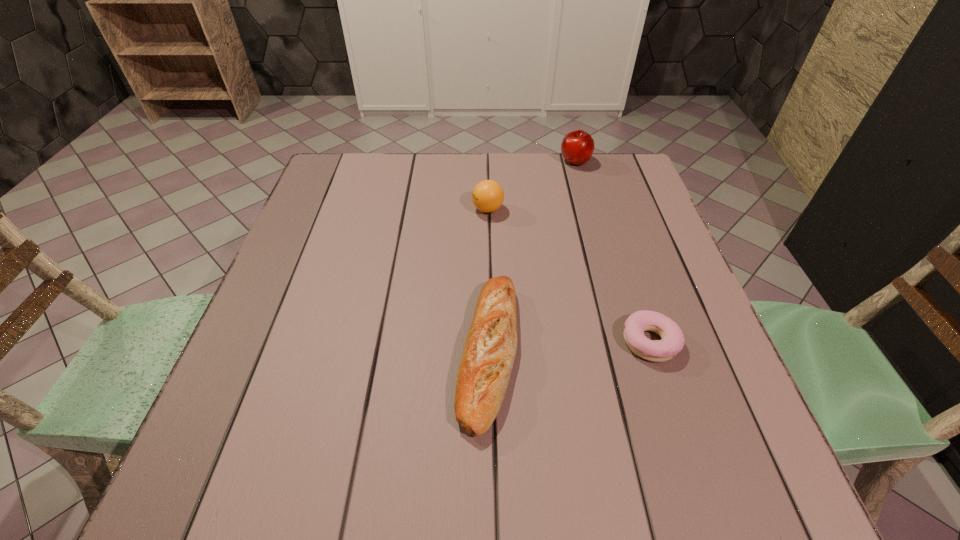
Where is `the farthest object`? Image resolution: width=960 pixels, height=540 pixels. the farthest object is located at coordinates (577, 147).

Identify the location of the tallest object. (577, 147).

Identify the location of ping-pong ball. The image size is (960, 540). (487, 196).

Identify the location of the third shortest object. (487, 196).

Where is `the third tallest object`? Image resolution: width=960 pixels, height=540 pixels. the third tallest object is located at coordinates (489, 352).

The width and height of the screenshot is (960, 540). Identify the location of doughnut. (673, 340).

Locate an element on the screen. Image resolution: width=960 pixels, height=540 pixels. free location located on the right of the apple is located at coordinates (617, 161).

Locate an element on the screen. The image size is (960, 540). vacant space located 0.340m on the side with brand of the second farthest object is located at coordinates (343, 210).

At what (x,y) coordinates should I click in order to perform the action: click on vacant region located 0.200m on the side with brand of the second farthest object. Please return your answer as a coordinate pair (x, y). This screenshot has width=960, height=540. Looking at the image, I should click on (396, 210).

Locate an element on the screen. This screenshot has height=540, width=960. free space located 0.330m on the side with brand of the second farthest object is located at coordinates point(347,210).